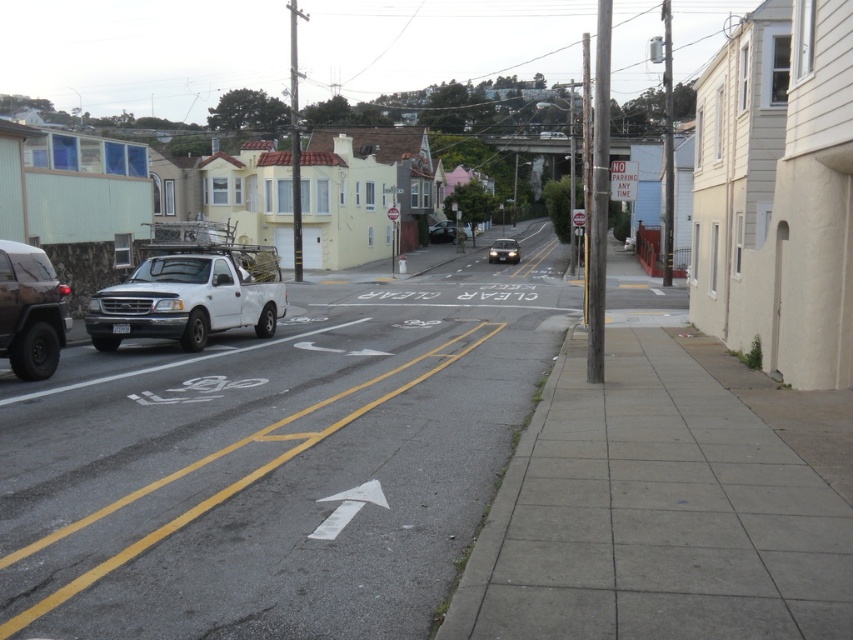
You are standing at the point marked as point (x=502, y=240) and want to walk to the point marked as point (x=41, y=273). Which direction should you move relative to your current position?

You should move forward because point (x=41, y=273) is closer to the viewer than point (x=502, y=240), meaning it is in front of your current position.

You are standing at the point marked by coordinates [276,467] in the image. What material are you standing on?

You are standing on gray asphalt at center.

In the scene shown: You are a delivery driver in a van that is 3 meters long. You need to park your van between the white matte truck at left and the matte black suv at left. Is there enough space between them for your van?

The distance between the white matte truck at left and the matte black suv at left is 3.75 meters. Since your van is 3 meters long, there is enough space to park between them.